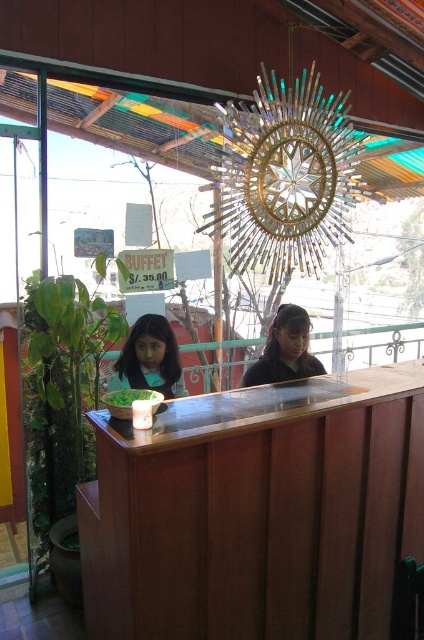
You are a customer at the restaurant and want to place your salad bowl on the brown wood table at center. Can you put it directly under the green leafy vegetable at center without moving the vegetable?

The brown wood table at center is below green leafy vegetable at center, so placing the salad bowl directly under the green leafy vegetable at center would be possible as the table is positioned beneath it.

You are a customer at the restaurant and you see the matte black shirt at center and the green leafy vegetable at center on the counter. Which object is positioned more to the left?

The green leafy vegetable at center is positioned more to the left because the matte black shirt at center is to its right.

You are a customer standing in front of the wooden counter and want to place an order. There are two points marked on the counter where you can hand over your order. One is at point (x=301, y=349) and the other is at point (x=108, y=397). Which point is closer to you as you stand in front of the counter?

Point (x=301, y=349) is closer to you because it is further to the viewer than point (x=108, y=397).